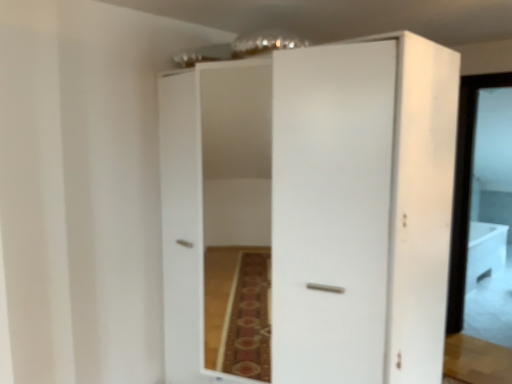
This screenshot has width=512, height=384. What do you see at coordinates (311, 211) in the screenshot?
I see `white matte cupboard at center` at bounding box center [311, 211].

The image size is (512, 384). What are the coordinates of `white matte cupboard at center` in the screenshot? It's located at (311, 211).

Measure the distance between point (325, 222) and camera.

1.77 meters.

You are a GUI agent. You are given a task and a screenshot of the screen. Output one action in this format:
    pyautogui.click(x=<x>, y=<y>)
    Task: Click on the white matte cupboard at center
    Image resolution: width=512 pixels, height=384 pixels.
    Given the screenshot: What is the action you would take?
    pyautogui.click(x=311, y=211)